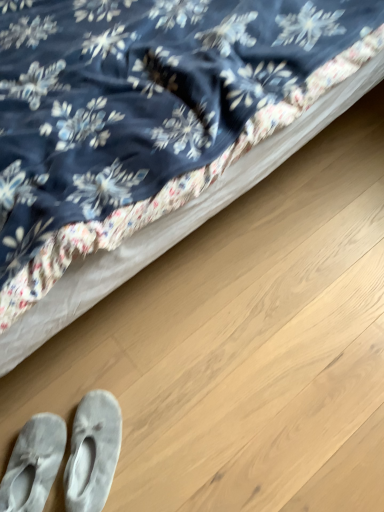
Question: Is light gray suede slippers at lower left, arranged as the second footwear when viewed from the left, oriented away from gray suede slippers at lower left, acting as the first footwear starting from the left?

Choices:
 (A) yes
 (B) no

Answer: (B)

Question: Would you say light gray suede slippers at lower left, arranged as the second footwear when viewed from the left, contains gray suede slippers at lower left, acting as the first footwear starting from the left?

Choices:
 (A) no
 (B) yes

Answer: (A)

Question: Is light gray suede slippers at lower left, which is the 1th footwear in right-to-left order, far from gray suede slippers at lower left, acting as the first footwear starting from the left?

Choices:
 (A) no
 (B) yes

Answer: (A)

Question: Is light gray suede slippers at lower left, arranged as the second footwear when viewed from the left, oriented towards gray suede slippers at lower left, the 2th footwear viewed from the right?

Choices:
 (A) no
 (B) yes

Answer: (A)

Question: Are light gray suede slippers at lower left, which is the 1th footwear in right-to-left order, and gray suede slippers at lower left, the 2th footwear viewed from the right, beside each other?

Choices:
 (A) yes
 (B) no

Answer: (A)

Question: Considering the relative positions of light gray suede slippers at lower left, which is the 1th footwear in right-to-left order, and gray suede slippers at lower left, acting as the first footwear starting from the left, in the image provided, is light gray suede slippers at lower left, which is the 1th footwear in right-to-left order, to the left of gray suede slippers at lower left, acting as the first footwear starting from the left, from the viewer's perspective?

Choices:
 (A) yes
 (B) no

Answer: (B)

Question: From the image's perspective, is gray suede slippers at lower left, the 2th footwear viewed from the right, located above light gray suede slippers at lower left, arranged as the second footwear when viewed from the left?

Choices:
 (A) yes
 (B) no

Answer: (B)

Question: Is gray suede slippers at lower left, acting as the first footwear starting from the left, positioned beyond the bounds of light gray suede slippers at lower left, which is the 1th footwear in right-to-left order?

Choices:
 (A) yes
 (B) no

Answer: (A)

Question: Can you confirm if gray suede slippers at lower left, acting as the first footwear starting from the left, is taller than light gray suede slippers at lower left, which is the 1th footwear in right-to-left order?

Choices:
 (A) yes
 (B) no

Answer: (B)

Question: From a real-world perspective, is gray suede slippers at lower left, acting as the first footwear starting from the left, physically above light gray suede slippers at lower left, which is the 1th footwear in right-to-left order?

Choices:
 (A) yes
 (B) no

Answer: (B)

Question: Is gray suede slippers at lower left, the 2th footwear viewed from the right, next to light gray suede slippers at lower left, arranged as the second footwear when viewed from the left, and touching it?

Choices:
 (A) no
 (B) yes

Answer: (B)

Question: Can you confirm if gray suede slippers at lower left, acting as the first footwear starting from the left, is smaller than light gray suede slippers at lower left, arranged as the second footwear when viewed from the left?

Choices:
 (A) yes
 (B) no

Answer: (B)

Question: Is velvety blue bed at upper left behind gray suede slippers at lower left, acting as the first footwear starting from the left?

Choices:
 (A) no
 (B) yes

Answer: (A)